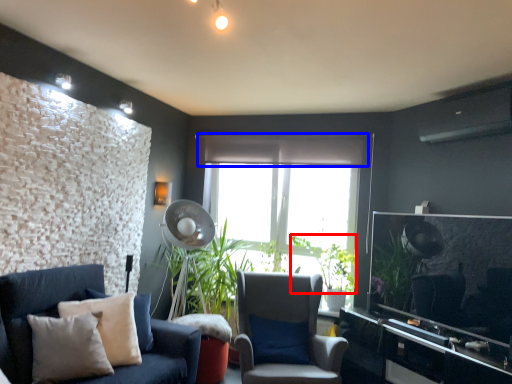
Question: Which object appears closest to the camera in this image, plant (highlighted by a red box) or curtain (highlighted by a blue box)?

Choices:
 (A) plant
 (B) curtain

Answer: (A)